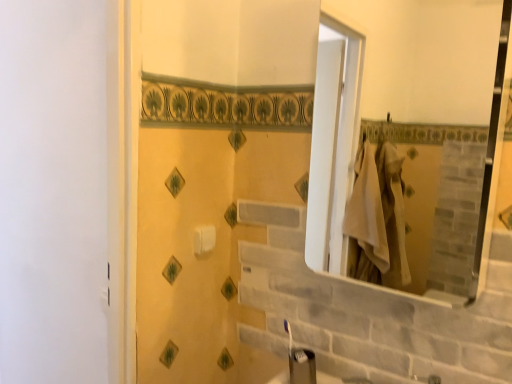
Question: From their relative heights in the image, would you say white glossy mirror at upper right is taller or shorter than white matte toilet paper at center?

Choices:
 (A) tall
 (B) short

Answer: (A)

Question: In terms of size, does white glossy mirror at upper right appear bigger or smaller than white matte toilet paper at center?

Choices:
 (A) big
 (B) small

Answer: (A)

Question: Considering the positions of white glossy mirror at upper right and white matte toilet paper at center in the image, is white glossy mirror at upper right wider or thinner than white matte toilet paper at center?

Choices:
 (A) thin
 (B) wide

Answer: (B)

Question: From a real-world perspective, relative to white glossy mirror at upper right, is white matte toilet paper at center vertically above or below?

Choices:
 (A) below
 (B) above

Answer: (A)

Question: Visually, is white matte toilet paper at center positioned to the left or to the right of white glossy mirror at upper right?

Choices:
 (A) left
 (B) right

Answer: (A)

Question: Looking at their shapes, would you say white matte toilet paper at center is wider or thinner than white glossy mirror at upper right?

Choices:
 (A) thin
 (B) wide

Answer: (A)

Question: Does point (214, 238) appear closer or farther from the camera than point (436, 97)?

Choices:
 (A) farther
 (B) closer

Answer: (B)